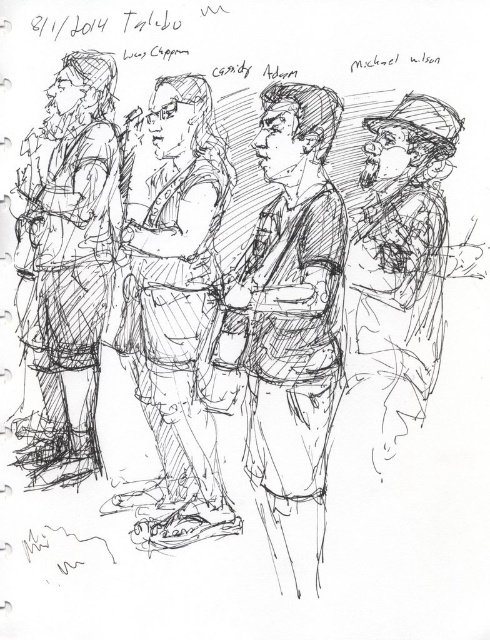
Is smooth skin tone figure at center below shiny metallic hat at right?

Yes, smooth skin tone figure at center is below shiny metallic hat at right.

Who is more forward, (320,188) or (362,186)?

Point (320,188) is more forward.

This screenshot has height=640, width=490. I want to click on smooth skin tone figure at center, so click(292, 298).

Where is `smooth skin tone figure at center`? The height and width of the screenshot is (640, 490). smooth skin tone figure at center is located at coordinates (292, 298).

Can you confirm if smooth skin tone figure at center is positioned above matte black jacket at left?

No, smooth skin tone figure at center is not above matte black jacket at left.

Who is positioned more to the right, smooth skin tone figure at center or matte black jacket at left?

Positioned to the right is smooth skin tone figure at center.

Measure the distance between point (314, 147) and camera.

Point (314, 147) and camera are 8.08 feet apart from each other.

At what (x,y) coordinates should I click in order to perform the action: click on smooth skin tone figure at center. Please return your answer as a coordinate pair (x, y). This screenshot has height=640, width=490. Looking at the image, I should click on (292, 298).

Between point (76, 172) and point (420, 276), which one is positioned in front?

Positioned in front is point (420, 276).

Does point (52, 109) lie in front of point (390, 177)?

No, (52, 109) is behind (390, 177).

Image resolution: width=490 pixels, height=640 pixels. Find the location of `matte black jacket at left`. matte black jacket at left is located at coordinates (68, 262).